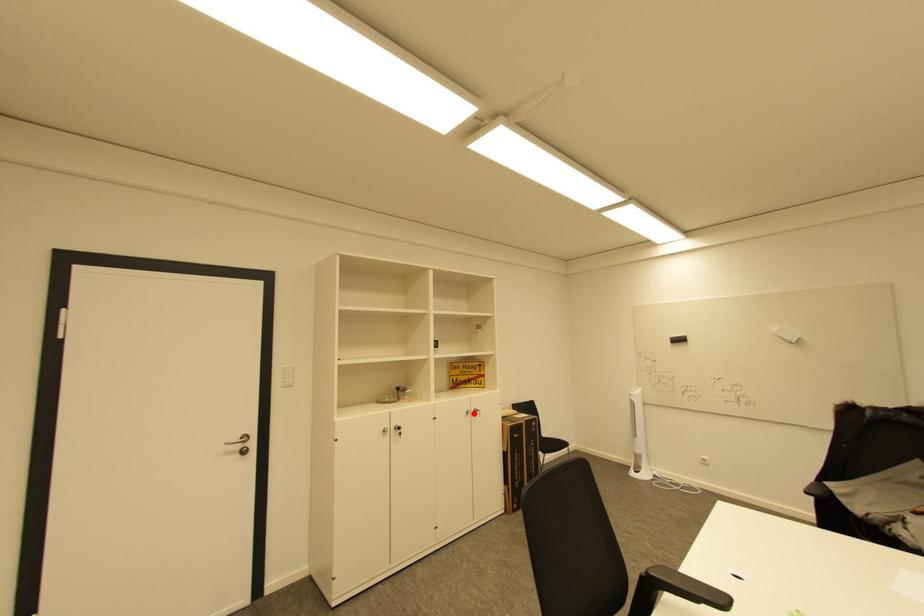
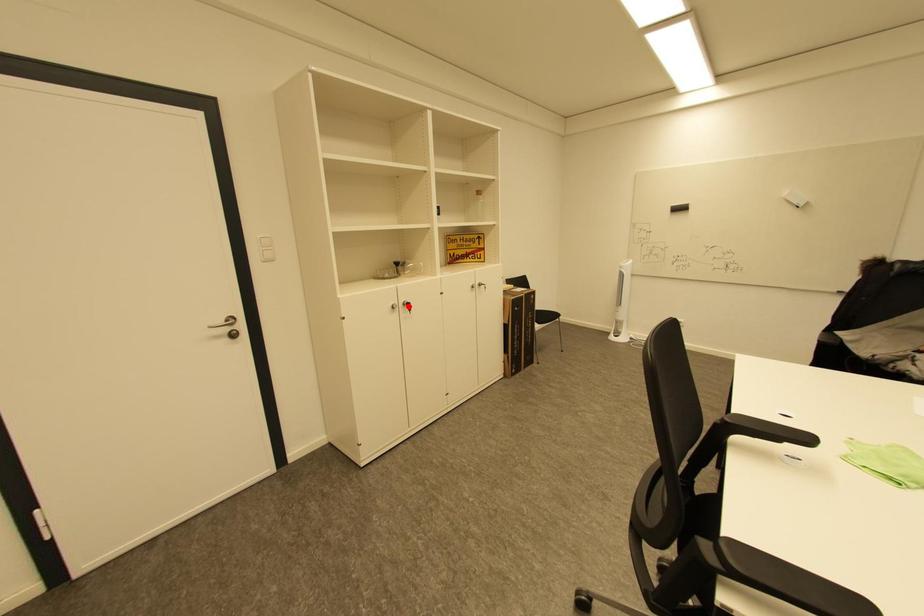
I am providing you with two images of the same scene from different viewpoints. A red point is marked on the first image and another point is marked on the second image. Is the marked point in image1 the same physical position as the marked point in image2?

No